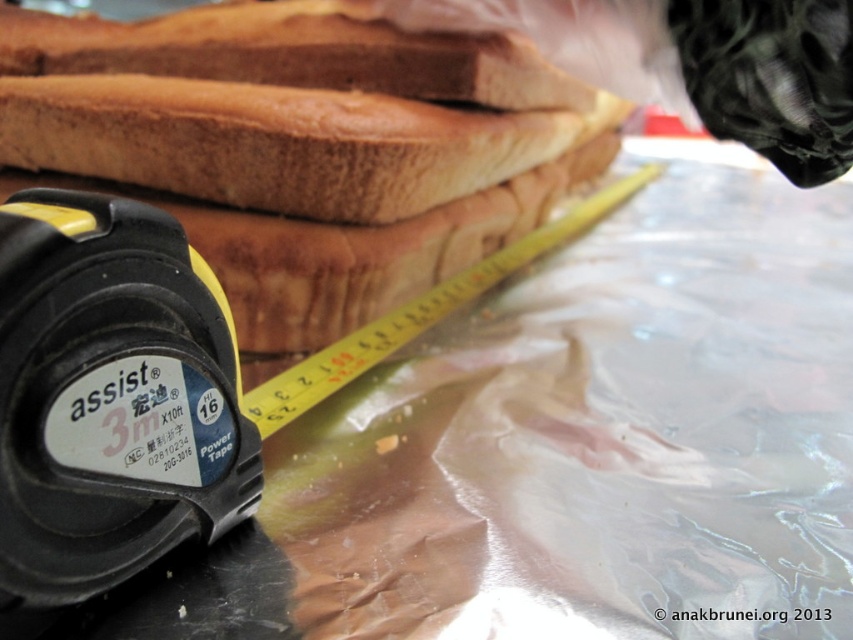
In order to click on black rubber tape measure at lower left in this screenshot , I will do `click(109, 397)`.

This screenshot has height=640, width=853. I want to click on black rubber tape measure at lower left, so click(109, 397).

Locate an element on the screen. black rubber tape measure at lower left is located at coordinates (109, 397).

Is point (120, 164) positioned behind point (7, 35)?

That is False.

Is golden brown bread at center to the right of golden brown bread at upper center from the viewer's perspective?

Yes, golden brown bread at center is to the right of golden brown bread at upper center.

Which is behind, point (437, 125) or point (160, 42)?

The point (160, 42) is more distant.

You are a GUI agent. You are given a task and a screenshot of the screen. Output one action in this format:
    pyautogui.click(x=<x>, y=<y>)
    Task: Click on the golden brown bread at center
    
    Given the screenshot: What is the action you would take?
    pyautogui.click(x=276, y=141)

This screenshot has height=640, width=853. What do you see at coordinates (154, 385) in the screenshot?
I see `yellow plastic tape measure at lower left` at bounding box center [154, 385].

What are the coordinates of `yellow plastic tape measure at lower left` in the screenshot? It's located at (154, 385).

Who is more distant from viewer, (436, 296) or (637, 182)?

Point (637, 182)

At what (x,y) coordinates should I click in order to perform the action: click on yellow plastic tape measure at lower left. Please return your answer as a coordinate pair (x, y). This screenshot has width=853, height=640. Looking at the image, I should click on (154, 385).